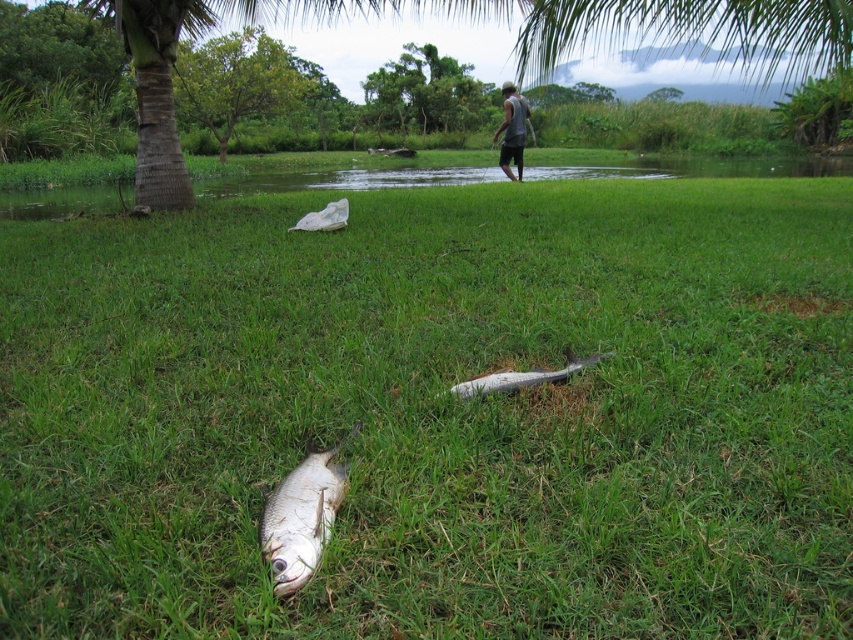
You are a photographer trying to capture the shiny silver fish at lower center and the gray fabric shirt at upper center in the same frame. Which object will appear smaller in your photo?

The shiny silver fish at lower center will appear smaller in the photo because it occupies less space than the gray fabric shirt at upper center.

Consider the image. You are a park visitor who wants to place a small item on the green grass at center. Can you fit the item on the white plastic bag at center without it hanging off?

The green grass at center is bigger than the white plastic bag at center, so the item might not fit if it is larger than the bag.

You are a park ranger who needs to retrieve the shiny silver fish at lower center. You are currently standing near the gray fabric shirt at upper center. Can you walk directly to the fish without crossing any obstacles? The path is clear except for a small stream that flows between them. The stream is 1.2 meters wide. Your boots can handle up to 1 meter of water depth. What should you do?

The shiny silver fish at lower center and gray fabric shirt at upper center are 12.62 meters apart. However, there is a 1.2 meters wide stream between them. Since your boots can only handle up to 1 meter of water depth, you should avoid walking directly through the stream. Instead, find a safer path around the stream to reach the shiny silver fish at lower center safely.